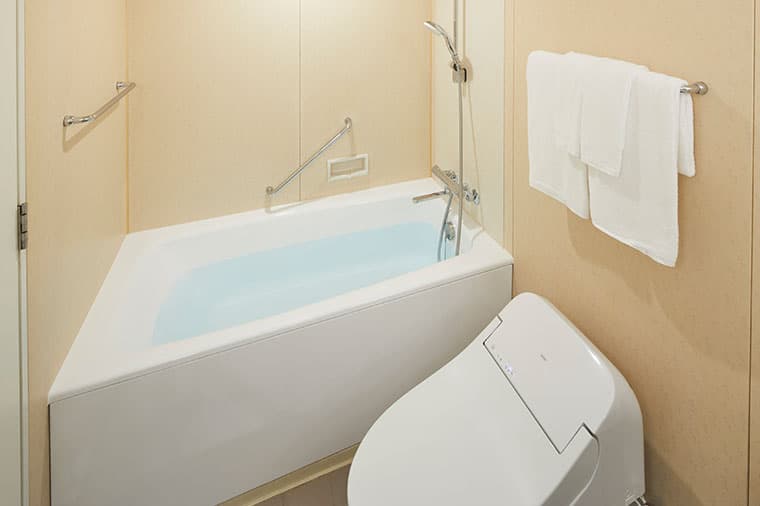
What are the coordinates of `bathtub` in the screenshot? It's located at click(178, 418).